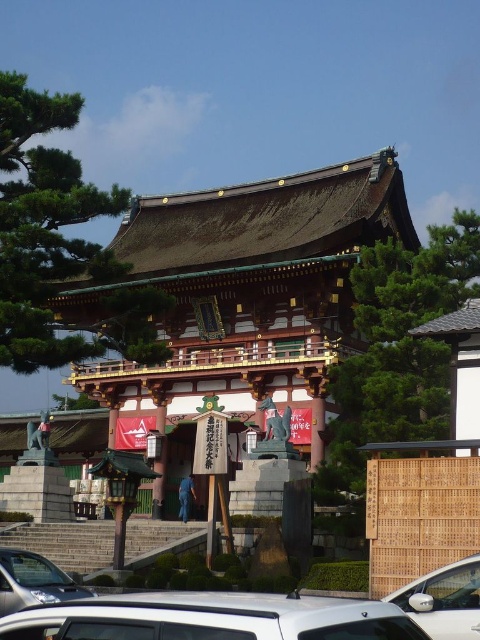
Question: Which point is closer to the camera taking this photo?

Choices:
 (A) (456, 602)
 (B) (286, 401)
 (C) (11, 604)
 (D) (68, 602)

Answer: (D)

Question: Which point is closer to the camera?

Choices:
 (A) (472, 625)
 (B) (107, 620)
 (C) (274, 372)
 (D) (79, 596)

Answer: (B)

Question: Is the position of shiny gold/wooden temple at center more distant than that of white matte car at lower center?

Choices:
 (A) no
 (B) yes

Answer: (B)

Question: Is white glossy car at lower right below silver metallic car at lower left?

Choices:
 (A) yes
 (B) no

Answer: (B)

Question: Among these points, which one is farthest from the camera?

Choices:
 (A) (263, 627)
 (B) (94, 595)
 (C) (337, 172)
 (D) (433, 632)

Answer: (C)

Question: Is shiny gold/wooden temple at center smaller than silver metallic car at lower left?

Choices:
 (A) no
 (B) yes

Answer: (A)